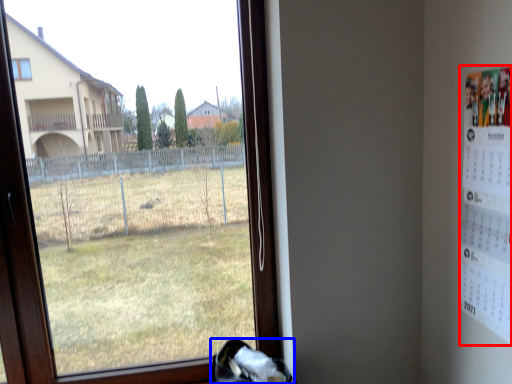
Question: Which object appears closest to the camera in this image, poster (highlighted by a red box) or shoe (highlighted by a blue box)?

Choices:
 (A) poster
 (B) shoe

Answer: (A)